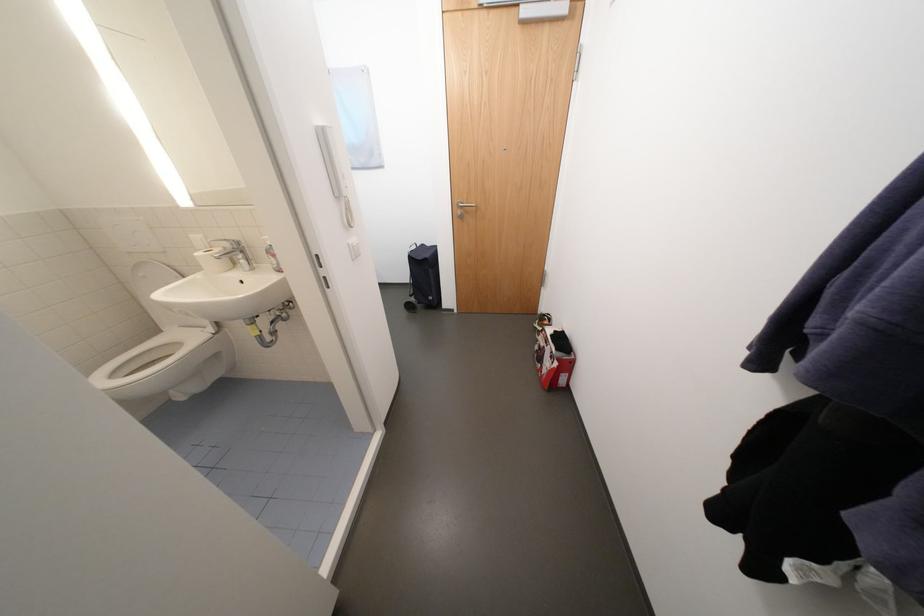
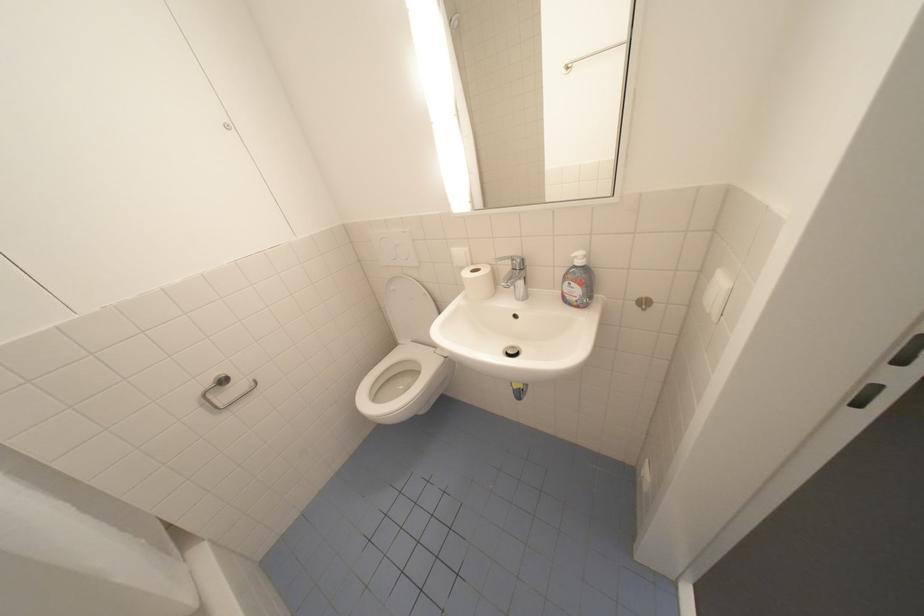
Question: The first image is from the beginning of the video and the second image is from the end. How did the camera likely rotate when shooting the video?

Choices:
 (A) Left
 (B) Right
 (C) Up
 (D) Down

Answer: (A)